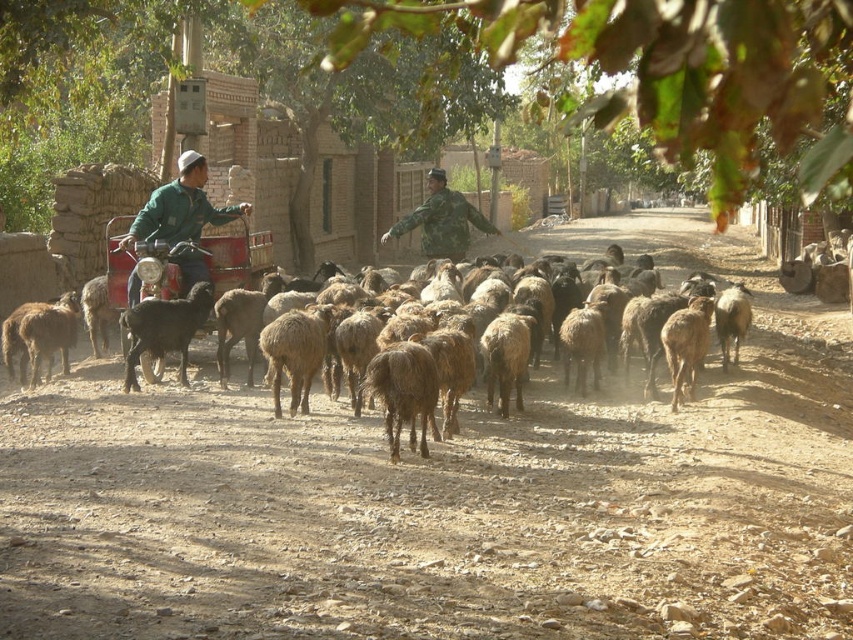
Question: From the image, what is the correct spatial relationship of brown dusty dirt track at center in relation to black woolen goat at left?

Choices:
 (A) above
 (B) below

Answer: (B)

Question: Which of the following is the farthest from the observer?

Choices:
 (A) green matte jacket at left
 (B) fuzzy woolen sheep at center
 (C) metallic red cart at left

Answer: (C)

Question: Is black woolen goat at left positioned at the back of camouflage uniform at center?

Choices:
 (A) yes
 (B) no

Answer: (B)

Question: Does brown dusty dirt track at center have a lesser width compared to black woolen goat at left?

Choices:
 (A) yes
 (B) no

Answer: (B)

Question: Which of the following is the closest to the observer?

Choices:
 (A) (206, 202)
 (B) (442, 204)
 (C) (149, 353)

Answer: (C)

Question: Which object appears farthest from the camera in this image?

Choices:
 (A) camouflage uniform at center
 (B) fuzzy woolen sheep at center
 (C) black woolen goat at left

Answer: (A)